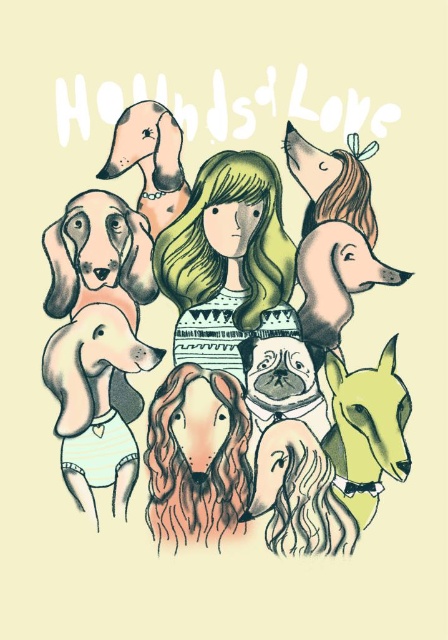
Question: Is pastel watercolor dogs at center to the left of smooth beige dog at upper left from the viewer's perspective?

Choices:
 (A) yes
 (B) no

Answer: (B)

Question: Which point is farther from the camera taking this photo?

Choices:
 (A) (267, 188)
 (B) (179, 173)

Answer: (A)

Question: Is pastel watercolor dogs at center above matte green dress at center?

Choices:
 (A) yes
 (B) no

Answer: (B)

Question: Which of the following is the farthest from the observer?

Choices:
 (A) (211, 163)
 (B) (149, 241)

Answer: (B)

Question: Which of these objects is positioned closest to the matte green dress at center?

Choices:
 (A) smooth beige dog at upper left
 (B) pastel watercolor dogs at center

Answer: (B)

Question: Is pastel watercolor dogs at center wider than smooth beige dog at upper left?

Choices:
 (A) yes
 (B) no

Answer: (A)